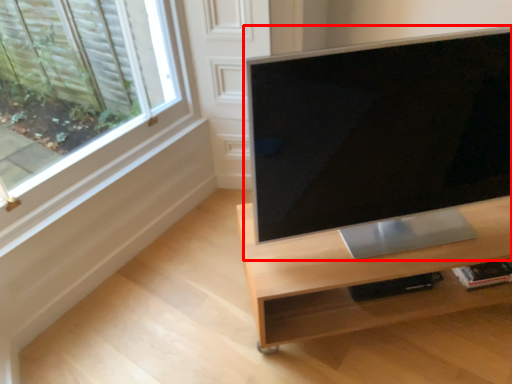
Question: In this image, where is computer monitor (annotated by the red box) located relative to desk?

Choices:
 (A) left
 (B) right

Answer: (A)